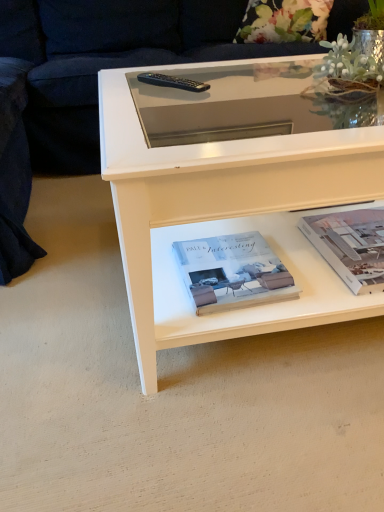
Question: From a real-world perspective, is white paper at lower right, positioned as the first paperback book in right-to-left order, over black plastic remote at upper center?

Choices:
 (A) no
 (B) yes

Answer: (A)

Question: From a real-world perspective, is white paper at lower right, which ranks as the second paperback book in left-to-right order, located beneath black plastic remote at upper center?

Choices:
 (A) no
 (B) yes

Answer: (B)

Question: Is white paper at lower right, positioned as the first paperback book in right-to-left order, to the left of black plastic remote at upper center from the viewer's perspective?

Choices:
 (A) no
 (B) yes

Answer: (A)

Question: Is white paper at lower right, positioned as the first paperback book in right-to-left order, outside of black plastic remote at upper center?

Choices:
 (A) no
 (B) yes

Answer: (B)

Question: Is white paper at lower right, which ranks as the second paperback book in left-to-right order, positioned before black plastic remote at upper center?

Choices:
 (A) no
 (B) yes

Answer: (B)

Question: From the image's perspective, is black plastic remote at upper center located above or below white matte book at center, the 2th paperback book viewed from the right?

Choices:
 (A) above
 (B) below

Answer: (A)

Question: From their relative heights in the image, would you say black plastic remote at upper center is taller or shorter than white matte book at center, the first paperback book positioned from the left?

Choices:
 (A) short
 (B) tall

Answer: (A)

Question: Considering the positions of black plastic remote at upper center and white matte book at center, the 2th paperback book viewed from the right, in the image, is black plastic remote at upper center bigger or smaller than white matte book at center, the 2th paperback book viewed from the right,?

Choices:
 (A) small
 (B) big

Answer: (A)

Question: Which is correct: black plastic remote at upper center is inside white matte book at center, the first paperback book positioned from the left, or outside of it?

Choices:
 (A) outside
 (B) inside

Answer: (A)

Question: From a real-world perspective, relative to white paper at lower right, which ranks as the second paperback book in left-to-right order, is dark blue fabric couch at upper left vertically above or below?

Choices:
 (A) below
 (B) above

Answer: (B)

Question: Would you say dark blue fabric couch at upper left is to the left or to the right of white paper at lower right, which ranks as the second paperback book in left-to-right order, in the picture?

Choices:
 (A) left
 (B) right

Answer: (A)

Question: From the image's perspective, is dark blue fabric couch at upper left positioned above or below white paper at lower right, positioned as the first paperback book in right-to-left order?

Choices:
 (A) below
 (B) above

Answer: (B)

Question: Would you say dark blue fabric couch at upper left is inside or outside white paper at lower right, positioned as the first paperback book in right-to-left order?

Choices:
 (A) outside
 (B) inside

Answer: (A)

Question: Based on their sizes in the image, would you say dark blue fabric couch at upper left is bigger or smaller than white matte book at center, the first paperback book positioned from the left?

Choices:
 (A) small
 (B) big

Answer: (B)

Question: Based on their positions, is dark blue fabric couch at upper left located to the left or right of white matte book at center, the 2th paperback book viewed from the right?

Choices:
 (A) right
 (B) left

Answer: (B)